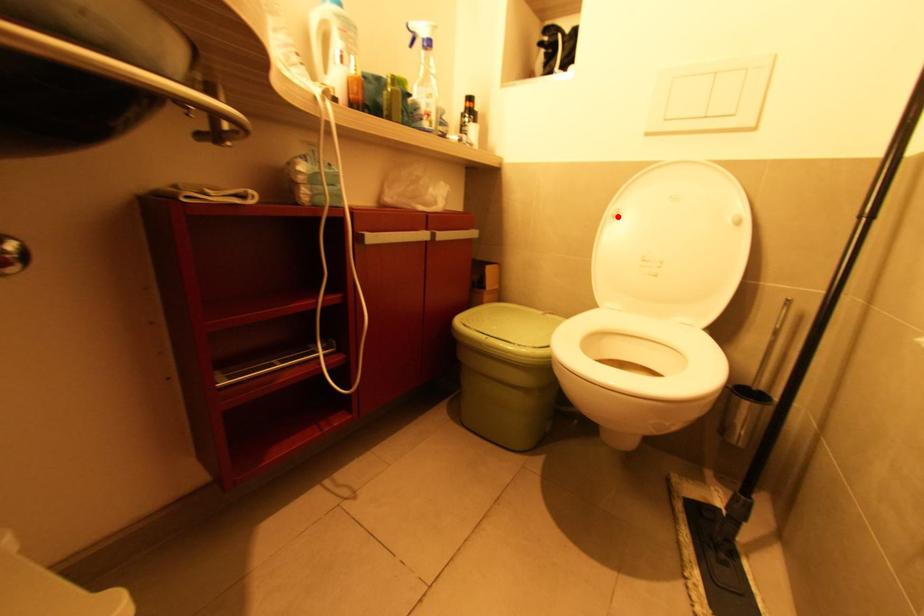
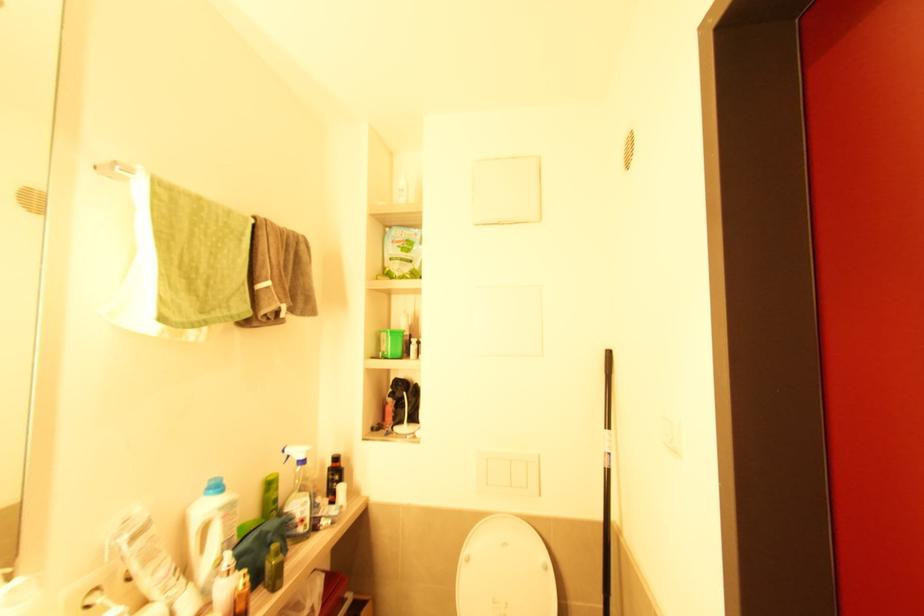
Where in the second image is the point corresponding to the highlighted location from the first image?

(469, 561)